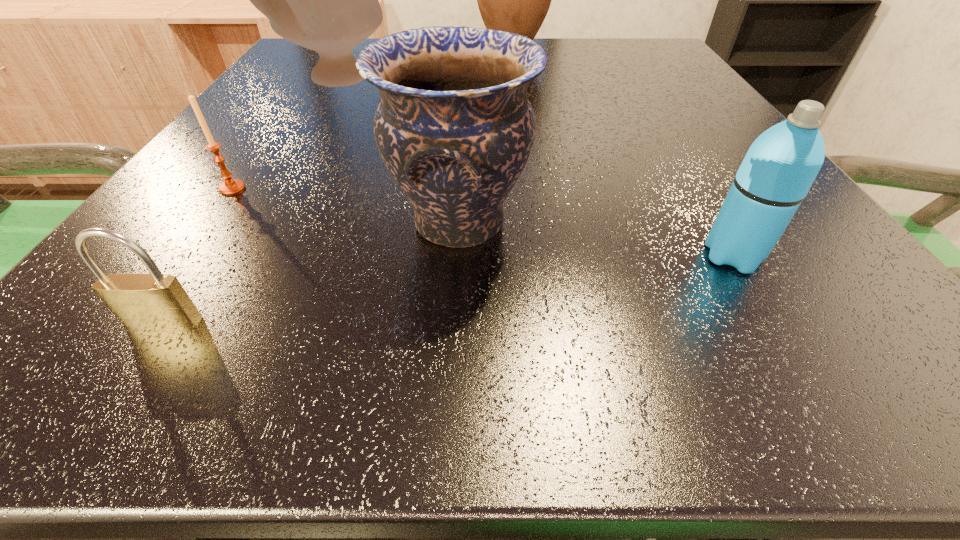
Identify the location of vacant space located on the front handle of the nearer pottery. (694, 223).

Where is `vacant space located 0.050m on the right of the rightmost object`? This screenshot has height=540, width=960. vacant space located 0.050m on the right of the rightmost object is located at coordinates (805, 256).

Identify the location of vacant point located on the right of the candle_holder. (416, 188).

The height and width of the screenshot is (540, 960). Identify the location of pitcher present at the far edge. (516, 0).

At what (x,y) coordinates should I click in order to perform the action: click on pottery positioned at the far edge. Please return your answer as a coordinate pair (x, y). The image size is (960, 540). Looking at the image, I should click on (326, 0).

Where is `object positioned at the near edge`? The height and width of the screenshot is (540, 960). object positioned at the near edge is located at coordinates (153, 301).

Identify the location of pottery present at the left edge. (326, 0).

I want to click on candle_holder that is at the left edge, so click(231, 186).

The image size is (960, 540). In order to click on padlock at the left edge in this screenshot , I will do `click(153, 301)`.

Locate an element on the screen. This screenshot has height=540, width=960. object that is at the right edge is located at coordinates (781, 165).